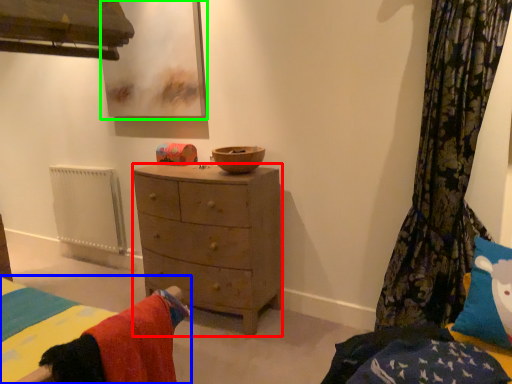
Question: Considering the real-world distances, which object is closest to nightstand (highlighted by a red box)? bed (highlighted by a blue box) or picture frame (highlighted by a green box).

Choices:
 (A) bed
 (B) picture frame

Answer: (B)